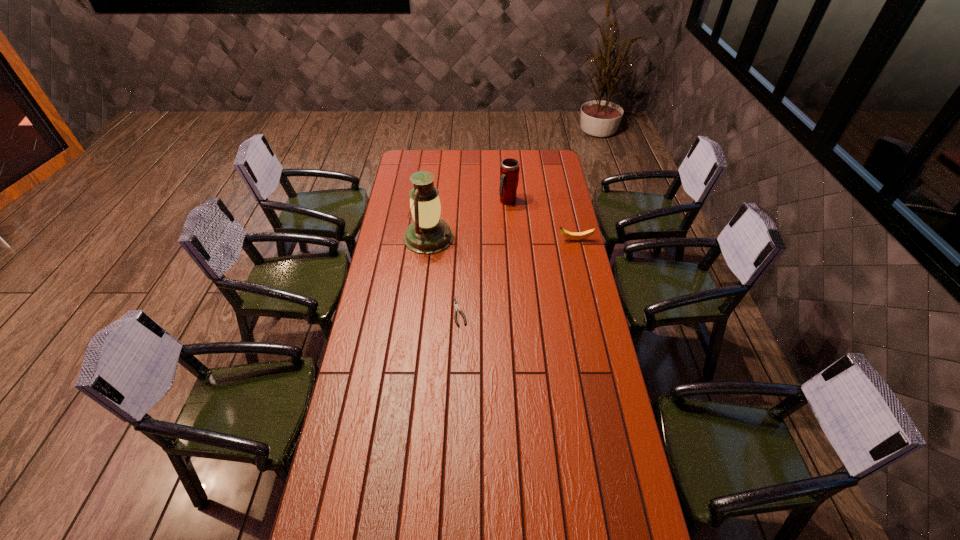
What are the coordinates of `free space that satisfies the following two spatial constraints: 1. on the back side of the third object from left to right; 2. on the right side of the lantern` in the screenshot? It's located at (433, 201).

Identify the location of free space that satisfies the following two spatial constraints: 1. on the front side of the leftmost object; 2. at the stem of the second shortest object. (428, 240).

Where is `vacant position in the image that satisfies the following two spatial constraints: 1. on the back side of the pliers; 2. at the stem of the third tallest object`? The width and height of the screenshot is (960, 540). vacant position in the image that satisfies the following two spatial constraints: 1. on the back side of the pliers; 2. at the stem of the third tallest object is located at coordinates (463, 240).